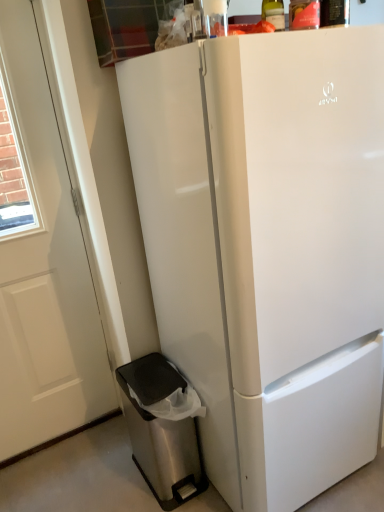
Question: Is white glossy refrigerator at center not inside stainless steel trash can at lower left?

Choices:
 (A) no
 (B) yes

Answer: (B)

Question: Does white glossy refrigerator at center contain stainless steel trash can at lower left?

Choices:
 (A) yes
 (B) no

Answer: (B)

Question: Considering the relative sizes of white glossy refrigerator at center and stainless steel trash can at lower left in the image provided, is white glossy refrigerator at center shorter than stainless steel trash can at lower left?

Choices:
 (A) yes
 (B) no

Answer: (B)

Question: Would you consider white glossy refrigerator at center to be distant from stainless steel trash can at lower left?

Choices:
 (A) yes
 (B) no

Answer: (B)

Question: Is white glossy refrigerator at center positioned in front of stainless steel trash can at lower left?

Choices:
 (A) yes
 (B) no

Answer: (A)

Question: Considering the relative positions of white glossy refrigerator at center and stainless steel trash can at lower left in the image provided, is white glossy refrigerator at center to the left or to the right of stainless steel trash can at lower left?

Choices:
 (A) right
 (B) left

Answer: (A)

Question: In terms of width, does white glossy refrigerator at center look wider or thinner when compared to stainless steel trash can at lower left?

Choices:
 (A) wide
 (B) thin

Answer: (A)

Question: In terms of size, does white glossy refrigerator at center appear bigger or smaller than stainless steel trash can at lower left?

Choices:
 (A) small
 (B) big

Answer: (B)

Question: Choose the correct answer: Is white glossy refrigerator at center inside stainless steel trash can at lower left or outside it?

Choices:
 (A) outside
 (B) inside

Answer: (A)

Question: Is white glossy refrigerator at center spatially inside translucent glass bottle at upper center, or outside of it?

Choices:
 (A) outside
 (B) inside

Answer: (A)

Question: Relative to translucent glass bottle at upper center, is white glossy refrigerator at center in front or behind?

Choices:
 (A) behind
 (B) front

Answer: (B)

Question: In terms of height, does white glossy refrigerator at center look taller or shorter compared to translucent glass bottle at upper center?

Choices:
 (A) tall
 (B) short

Answer: (A)

Question: Considering the positions of white glossy refrigerator at center and translucent glass bottle at upper center in the image, is white glossy refrigerator at center wider or thinner than translucent glass bottle at upper center?

Choices:
 (A) thin
 (B) wide

Answer: (B)

Question: From a real-world perspective, is white glossy refrigerator at center positioned above or below white matte door at left?

Choices:
 (A) below
 (B) above

Answer: (A)

Question: Would you say white glossy refrigerator at center is inside or outside white matte door at left?

Choices:
 (A) outside
 (B) inside

Answer: (A)